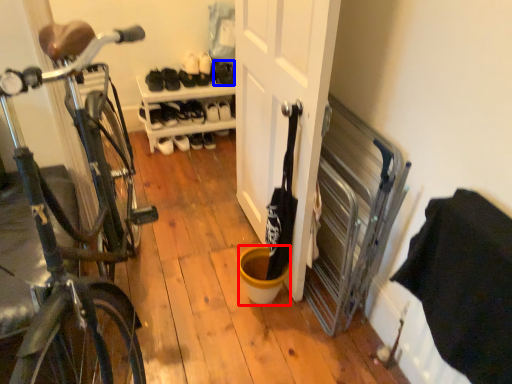
Question: Among these objects, which one is nearest to the camera, bucket (highlighted by a red box) or shoe (highlighted by a blue box)?

Choices:
 (A) bucket
 (B) shoe

Answer: (A)